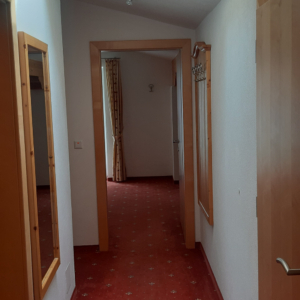
Find the location of a particular element. The width and height of the screenshot is (300, 300). door is located at coordinates (279, 224), (178, 146), (189, 164).